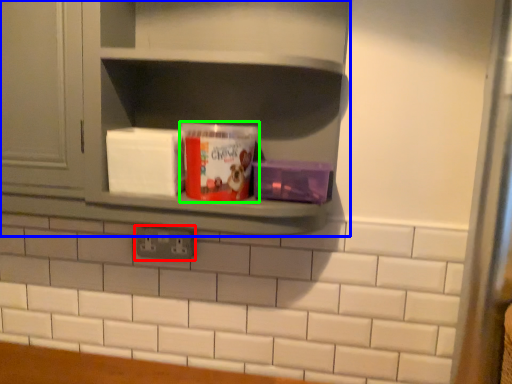
Question: Which object is positioned closest to electric outlet (highlighted by a red box)? Select from shelf (highlighted by a blue box) and yoghurt (highlighted by a green box).

Choices:
 (A) shelf
 (B) yoghurt

Answer: (B)